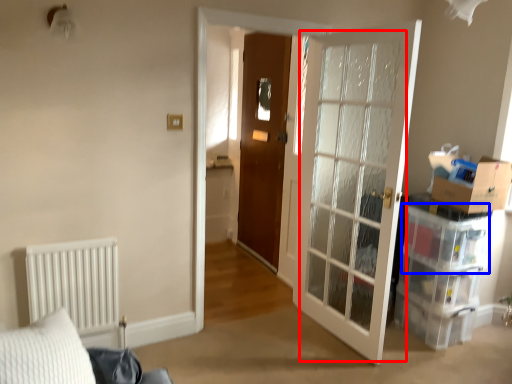
Question: Which object is closer to the camera taking this photo, glass door (highlighted by a red box) or storage box (highlighted by a blue box)?

Choices:
 (A) glass door
 (B) storage box

Answer: (A)